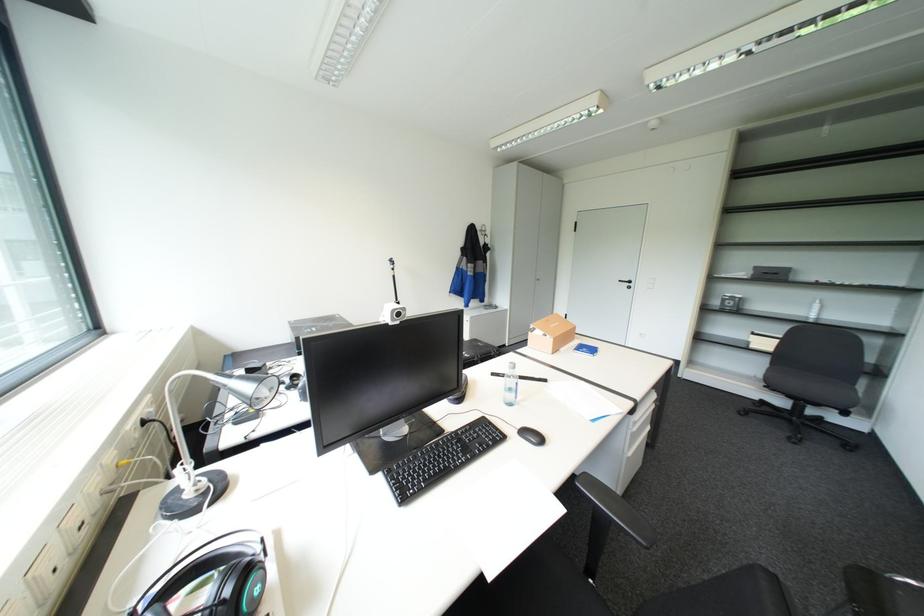
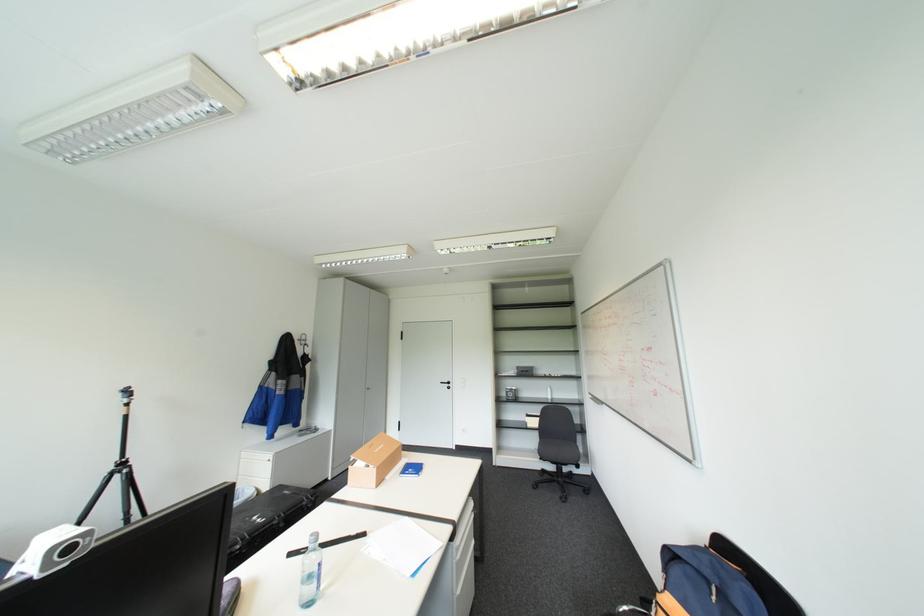
Locate, in the second image, the point that corresponds to pixel 538 331 in the first image.

(358, 464)